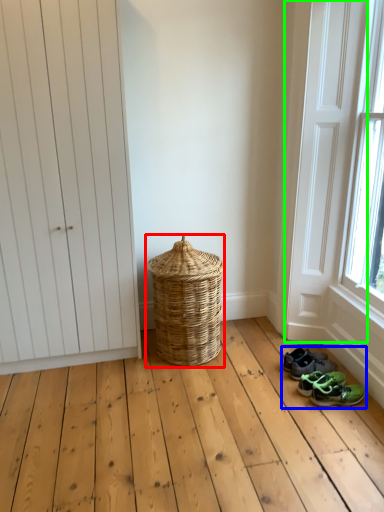
Question: Which object is the farthest from basket (highlighted by a red box)? Choose among these: footwear (highlighted by a blue box) or screen door (highlighted by a green box).

Choices:
 (A) footwear
 (B) screen door

Answer: (B)